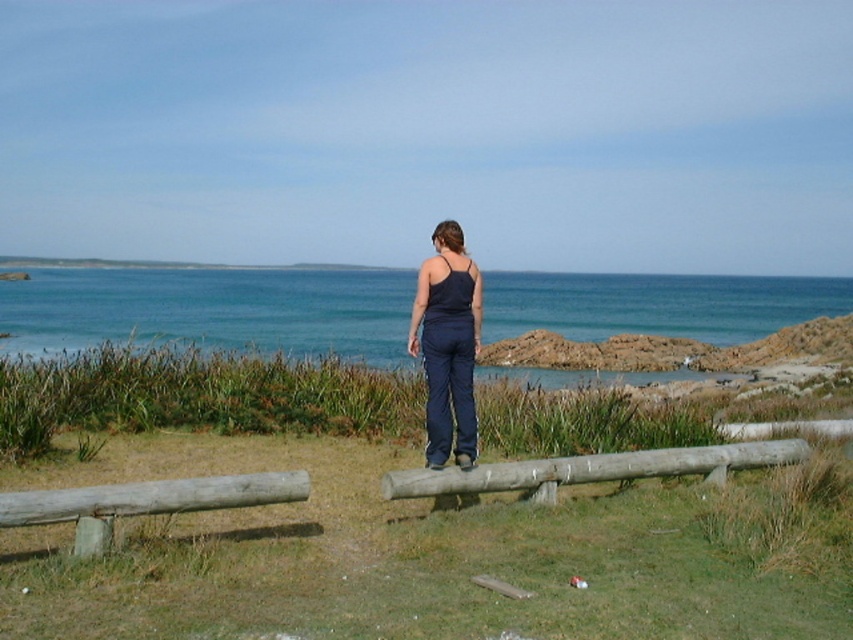
Who is more forward, [175,288] or [613,474]?

Point [613,474]

Is blue water at center shorter than smooth wooden log at center?

No, blue water at center is not shorter than smooth wooden log at center.

At what (x,y) coordinates should I click in order to perform the action: click on blue water at center. Please return your answer as a coordinate pair (x, y). Looking at the image, I should click on (212, 308).

Looking at this image, does navy blue fabric pants at center have a greater height compared to gray weathered log at lower left?

Yes.

Consider the image. Who is shorter, navy blue fabric pants at center or gray weathered log at lower left?

With less height is gray weathered log at lower left.

Describe the element at coordinates (447, 344) in the screenshot. I see `navy blue fabric pants at center` at that location.

Locate an element on the screen. navy blue fabric pants at center is located at coordinates (447, 344).

Does blue water at center have a larger size compared to gray weathered log at lower left?

Indeed, blue water at center has a larger size compared to gray weathered log at lower left.

Does blue water at center appear on the left side of gray weathered log at lower left?

Incorrect, blue water at center is not on the left side of gray weathered log at lower left.

At what (x,y) coordinates should I click in order to perform the action: click on blue water at center. Please return your answer as a coordinate pair (x, y). The width and height of the screenshot is (853, 640). Looking at the image, I should click on (212, 308).

What are the coordinates of `blue water at center` in the screenshot? It's located at (212, 308).